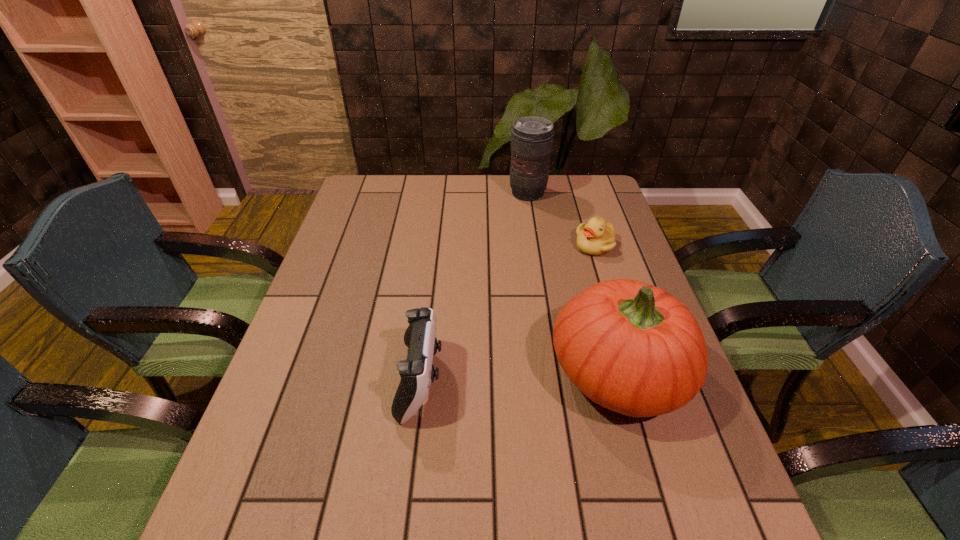
Where is `vacant area at the right edge of the desktop`? The width and height of the screenshot is (960, 540). vacant area at the right edge of the desktop is located at coordinates (665, 423).

Where is `free location at the far left corner`? The image size is (960, 540). free location at the far left corner is located at coordinates (380, 211).

In the image, there is a desktop. At what (x,y) coordinates should I click in order to perform the action: click on vacant region at the near left corner. Please return your answer as a coordinate pair (x, y). The image size is (960, 540). Looking at the image, I should click on (310, 451).

Locate an element on the screen. vacant space at the far right corner of the desktop is located at coordinates (568, 188).

At what (x,y) coordinates should I click in order to perform the action: click on free space between the shortest object and the control. Please return your answer as a coordinate pair (x, y). The image size is (960, 540). Looking at the image, I should click on pyautogui.click(x=508, y=313).

Identify the location of vacant region between the farthest object and the pumpkin. (573, 283).

Locate an element on the screen. The height and width of the screenshot is (540, 960). vacant region between the pumpkin and the second shortest object is located at coordinates (519, 376).

Where is `free point between the leftmost object and the pumpkin`? This screenshot has width=960, height=540. free point between the leftmost object and the pumpkin is located at coordinates (519, 376).

Find the location of `vacant space in between the third nearest object and the control`. vacant space in between the third nearest object and the control is located at coordinates (508, 313).

Find the location of a particular element. vacant region between the telephoto lens and the third nearest object is located at coordinates (562, 220).